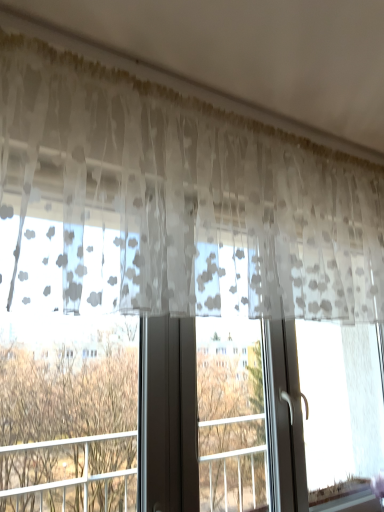
Question: Which direction should I rotate to look at transparent floral-patterned curtain at upper center?

Choices:
 (A) left
 (B) right

Answer: (B)

Question: From the image's perspective, does transparent floral-patterned curtain at upper center appear lower than brown leafy tree at left?

Choices:
 (A) yes
 (B) no

Answer: (B)

Question: Is transparent floral-patterned curtain at upper center located outside brown leafy tree at left?

Choices:
 (A) no
 (B) yes

Answer: (B)

Question: Is transparent floral-patterned curtain at upper center wider than brown leafy tree at left?

Choices:
 (A) yes
 (B) no

Answer: (A)

Question: Is transparent floral-patterned curtain at upper center placed right next to brown leafy tree at left?

Choices:
 (A) yes
 (B) no

Answer: (B)

Question: Does transparent floral-patterned curtain at upper center lie in front of brown leafy tree at left?

Choices:
 (A) yes
 (B) no

Answer: (A)

Question: Is transparent floral-patterned curtain at upper center positioned far away from brown leafy tree at left?

Choices:
 (A) no
 (B) yes

Answer: (A)

Question: From the image's perspective, is brown leafy tree at left above transparent floral-patterned curtain at upper center?

Choices:
 (A) no
 (B) yes

Answer: (A)

Question: Is brown leafy tree at left touching transparent floral-patterned curtain at upper center?

Choices:
 (A) no
 (B) yes

Answer: (A)

Question: Does brown leafy tree at left contain transparent floral-patterned curtain at upper center?

Choices:
 (A) no
 (B) yes

Answer: (A)

Question: Is brown leafy tree at left shorter than transparent floral-patterned curtain at upper center?

Choices:
 (A) yes
 (B) no

Answer: (A)

Question: Is brown leafy tree at left positioned with its back to transparent floral-patterned curtain at upper center?

Choices:
 (A) no
 (B) yes

Answer: (A)

Question: Is brown leafy tree at left not within transparent floral-patterned curtain at upper center?

Choices:
 (A) yes
 (B) no

Answer: (A)

Question: In the image, is transparent floral-patterned curtain at upper center on the left side or the right side of brown leafy tree at left?

Choices:
 (A) right
 (B) left

Answer: (A)